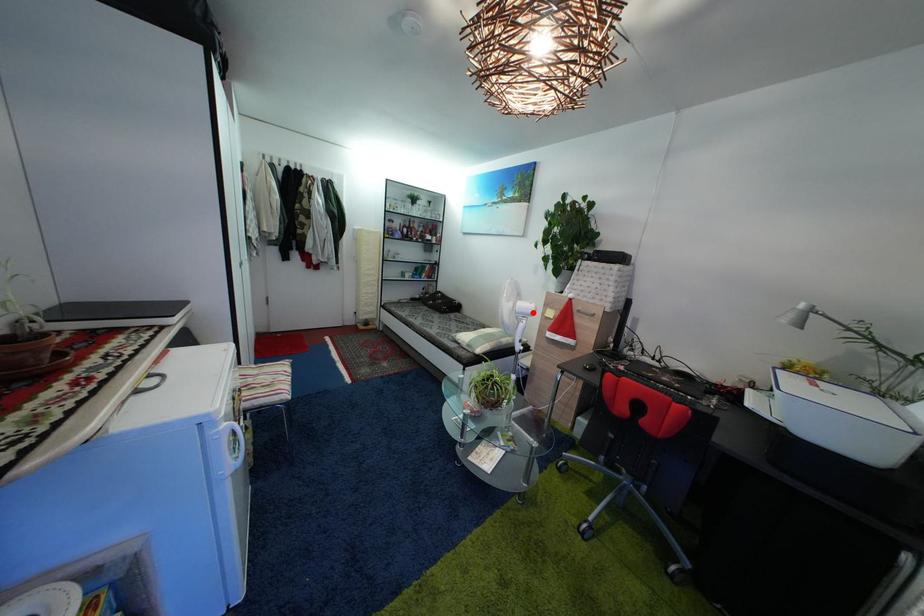
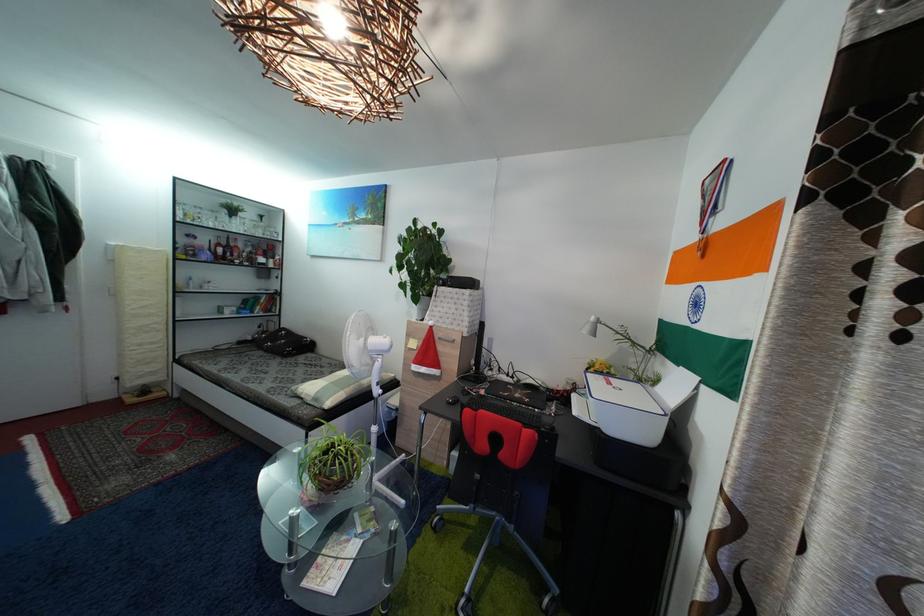
Where in the second image is the point corresponding to the highlighted location from the first image?

(386, 349)